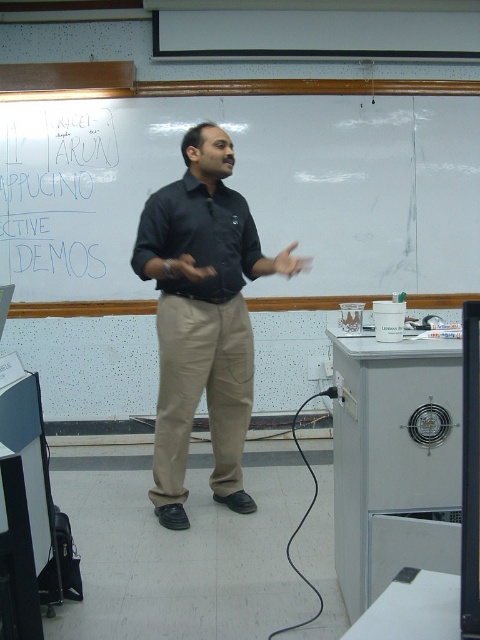
Is point (110, 280) closer to viewer compared to point (182, 428)?

No.

Can you confirm if whiteboard at upper center is smaller than khaki pants at center?

No, whiteboard at upper center is not smaller than khaki pants at center.

Is point (24, 211) farther from camera compared to point (214, 408)?

That is True.

Locate an element on the screen. whiteboard at upper center is located at coordinates (245, 189).

From the picture: Is black shirt at center above black matte shirt at center?

No, black shirt at center is not above black matte shirt at center.

Is black shirt at center taller than black matte shirt at center?

Yes, black shirt at center is taller than black matte shirt at center.

Who is more forward, [201,141] or [139,275]?

Positioned in front is point [139,275].

You are a GUI agent. You are given a task and a screenshot of the screen. Output one action in this format:
    pyautogui.click(x=<x>, y=<y>)
    Task: Click on the black shirt at center
    The image size is (480, 640).
    Given the screenshot: What is the action you would take?
    pyautogui.click(x=203, y=317)

Measure the distance between black shirt at center and blue marker writing at upper left.

black shirt at center and blue marker writing at upper left are 4.83 feet apart from each other.

Which of these two, black shirt at center or blue marker writing at upper left, stands taller?

With more height is black shirt at center.

Is point (176, 372) less distant than point (26, 180)?

That is True.

Find the location of `black shirt at center`. black shirt at center is located at coordinates (203, 317).